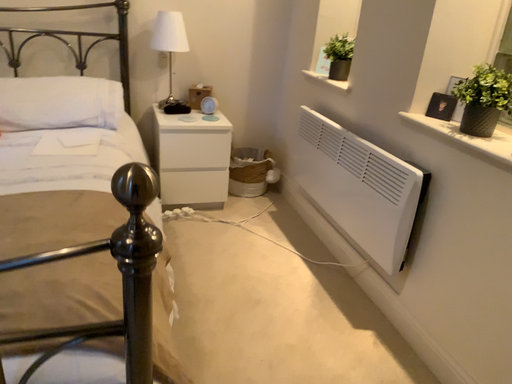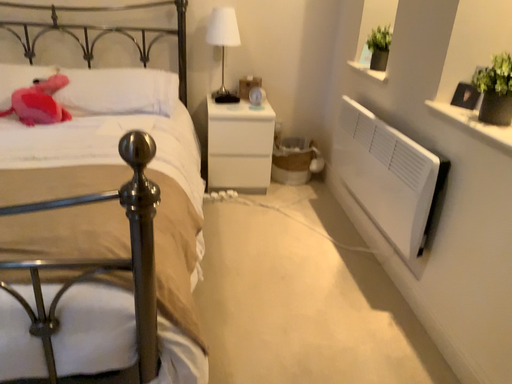
Question: Which way did the camera rotate in the video?

Choices:
 (A) rotated left
 (B) rotated right

Answer: (A)